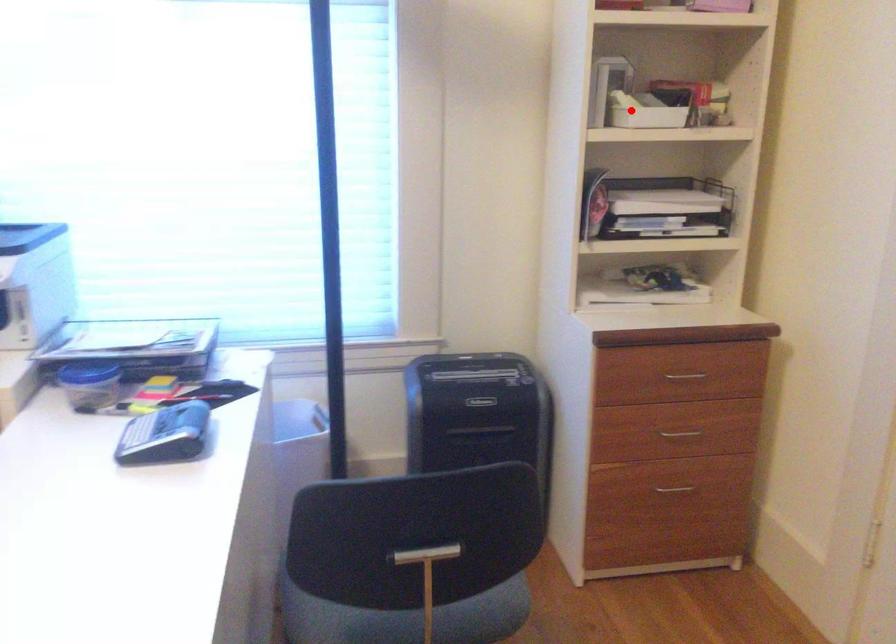
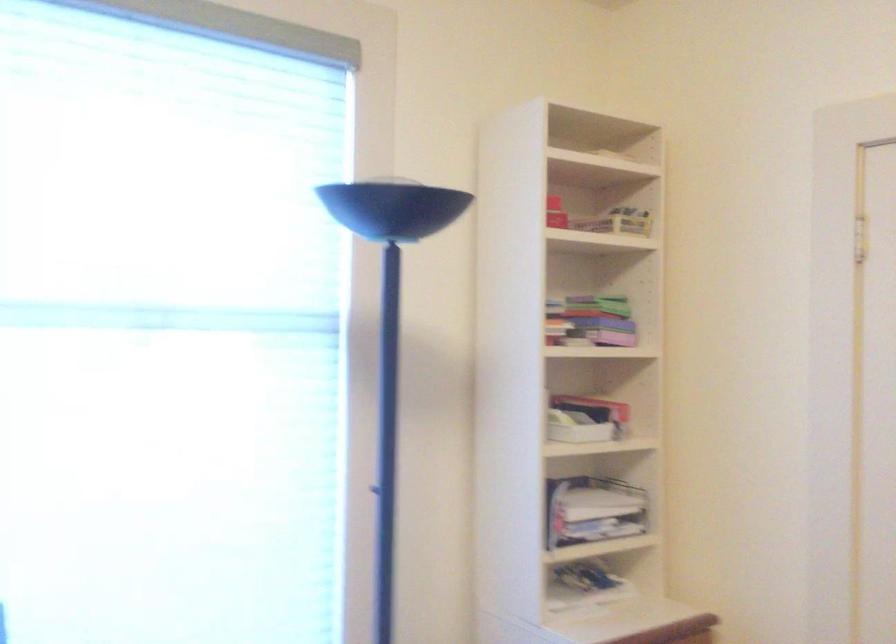
Where in the second image is the point corresponding to the highlighted location from the first image?

(576, 428)